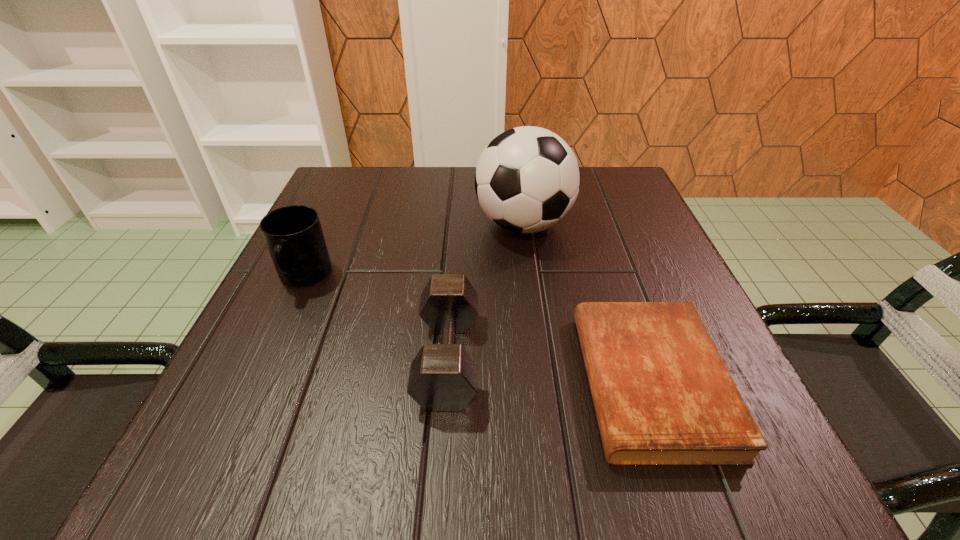
Where is `vacant space situated 0.390m on the spine side of the Bible`? Image resolution: width=960 pixels, height=540 pixels. vacant space situated 0.390m on the spine side of the Bible is located at coordinates (316, 382).

At what (x,y) coordinates should I click in order to perform the action: click on vacant space positioned 0.380m on the spine side of the Bible. Please return your answer as a coordinate pair (x, y). The image size is (960, 540). Looking at the image, I should click on (323, 382).

This screenshot has width=960, height=540. In order to click on object situated at the far edge in this screenshot , I will do `click(527, 179)`.

Locate an element on the screen. object that is positioned at the near edge is located at coordinates (662, 394).

This screenshot has width=960, height=540. Identify the location of object at the left edge. (293, 234).

Locate an element on the screen. object positioned at the right edge is located at coordinates (662, 394).

Identify the location of object located in the near right corner section of the desktop. (662, 394).

The image size is (960, 540). I want to click on free spot at the far edge of the desktop, so click(463, 180).

In the image, there is a desktop. What are the coordinates of `free space at the left edge` in the screenshot? It's located at (277, 320).

Find the location of a particular element. The image size is (960, 540). free spot at the right edge of the desktop is located at coordinates (608, 256).